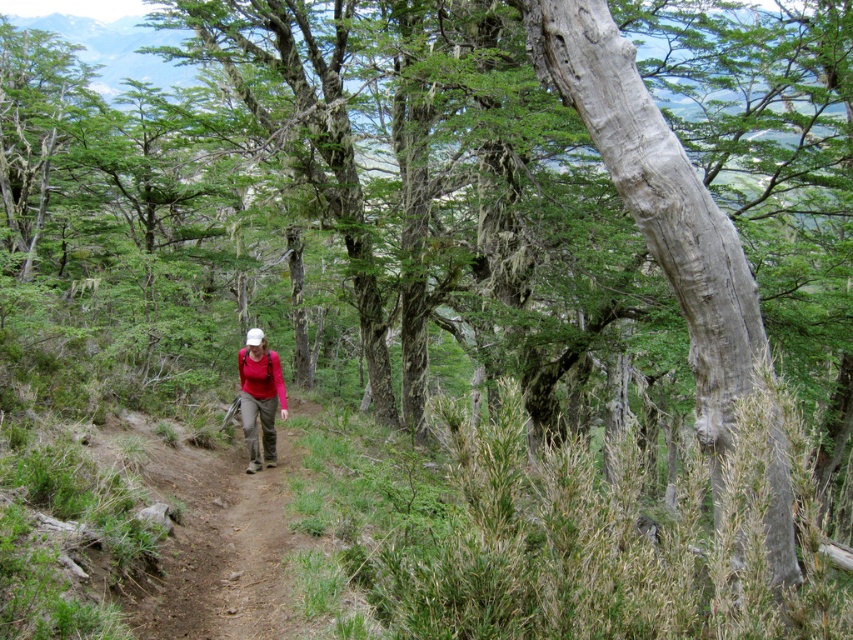
Does point (178, 625) come farther from viewer compared to point (248, 416)?

No, (178, 625) is closer to viewer.

Is brown dirt trail at center closer to the viewer compared to matte red shirt at center?

Yes, it is in front of matte red shirt at center.

Who is more distant from viewer, (274, 477) or (259, 332)?

The point (259, 332) is behind.

This screenshot has width=853, height=640. In order to click on brown dirt trail at center in this screenshot , I will do `click(219, 538)`.